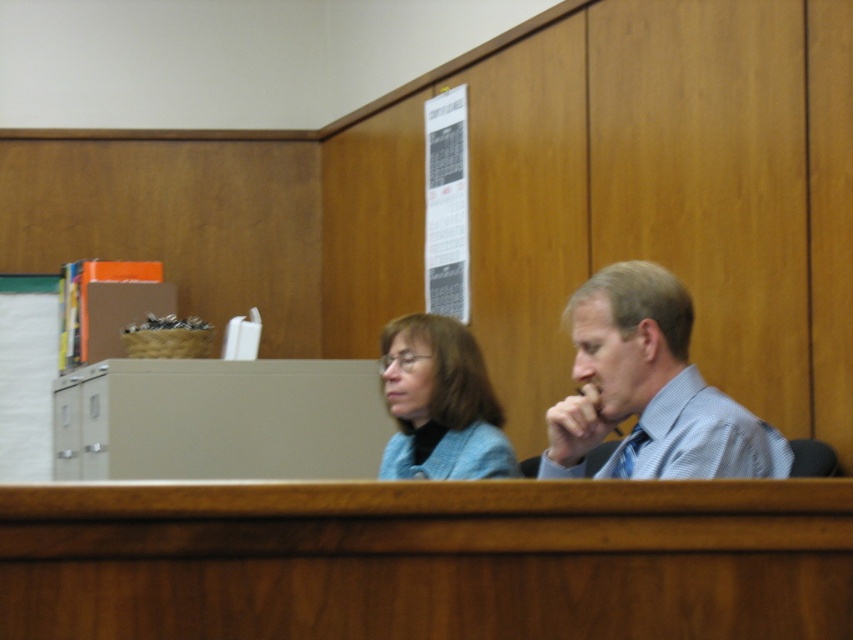
Question: Observing the image, what is the correct spatial positioning of wooden table at center in reference to blue fabric jacket at center?

Choices:
 (A) below
 (B) above

Answer: (A)

Question: Which object is the closest to the blue striped shirt at right?

Choices:
 (A) wooden table at center
 (B) blue fabric jacket at center

Answer: (B)

Question: Which point is closer to the camera?

Choices:
 (A) blue striped shirt at right
 (B) wooden table at center

Answer: (B)

Question: Which of the following is the farthest from the observer?

Choices:
 (A) blue striped shirt at right
 (B) blue fabric jacket at center
 (C) wooden table at center

Answer: (B)

Question: Is wooden table at center wider than blue striped shirt at right?

Choices:
 (A) yes
 (B) no

Answer: (A)

Question: Does wooden table at center appear on the left side of blue striped shirt at right?

Choices:
 (A) no
 (B) yes

Answer: (B)